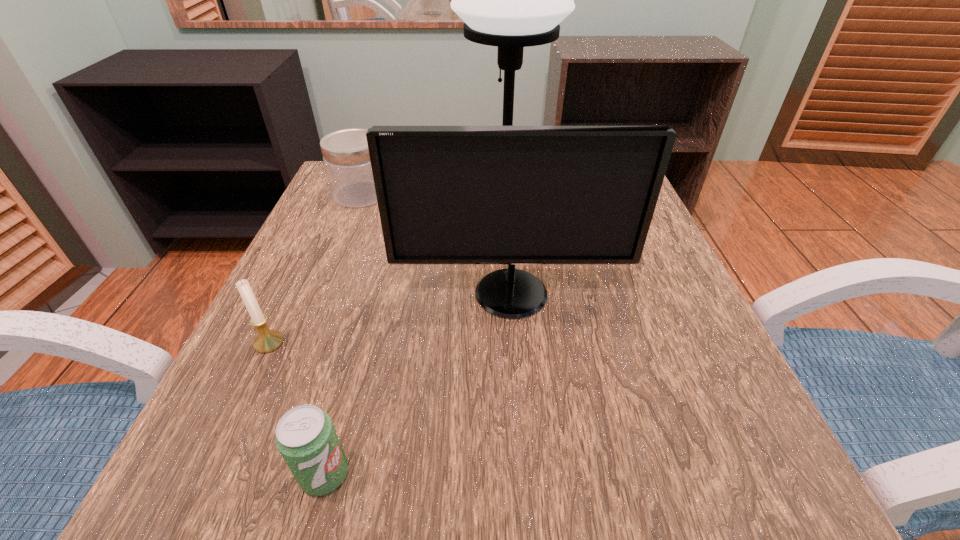
Identify the location of the tallest object. The width and height of the screenshot is (960, 540). (512, 0).

The width and height of the screenshot is (960, 540). In order to click on the third farthest object in this screenshot , I will do `click(510, 195)`.

Identify the location of computer monitor. (510, 195).

In order to click on jar in this screenshot , I will do `click(345, 152)`.

Find the location of a particular element. Image resolution: width=960 pixels, height=540 pixels. the fourth farthest object is located at coordinates (267, 340).

You are a GUI agent. You are given a task and a screenshot of the screen. Output one action in this format:
    pyautogui.click(x=<x>, y=<y>)
    Task: Click on the soda
    Image resolution: width=960 pixels, height=540 pixels.
    Given the screenshot: What is the action you would take?
    pyautogui.click(x=305, y=437)

This screenshot has width=960, height=540. I want to click on the nearest object, so click(x=305, y=437).

Locate an element on the screen. This screenshot has height=540, width=960. vacant space situated 0.230m on the left of the table lamp is located at coordinates (361, 195).

Locate an element on the screen. The width and height of the screenshot is (960, 540). free location located on the front-facing side of the third farthest object is located at coordinates (516, 358).

I want to click on vacant space located on the right of the jar, so click(x=413, y=194).